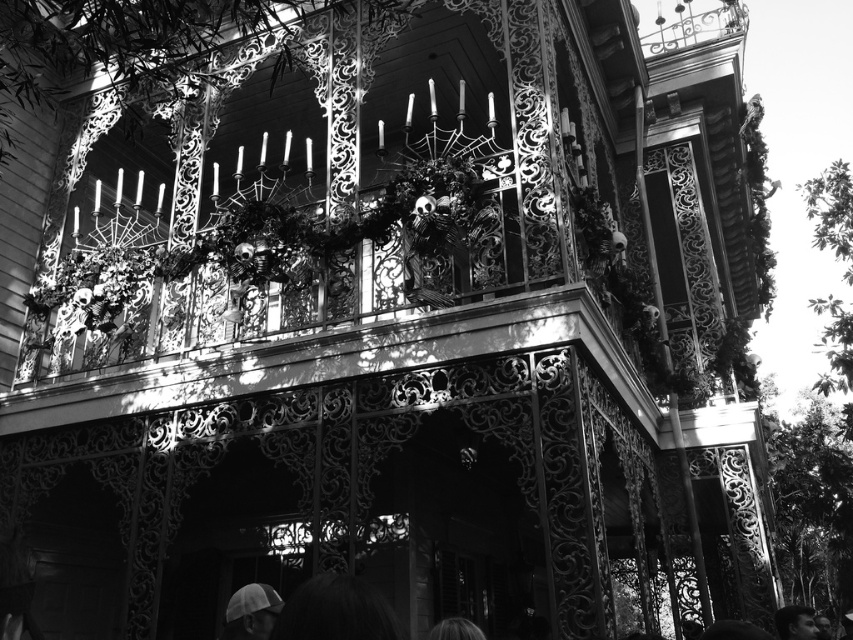
You are standing in front of the balcony and notice two points marked on the image. The first point is at coordinates point [241,595] and the second is at point [811,636]. Which point is closer to you?

Point [241,595] is closer to the viewer than point [811,636].